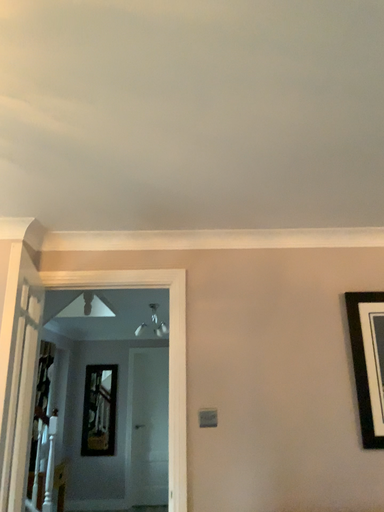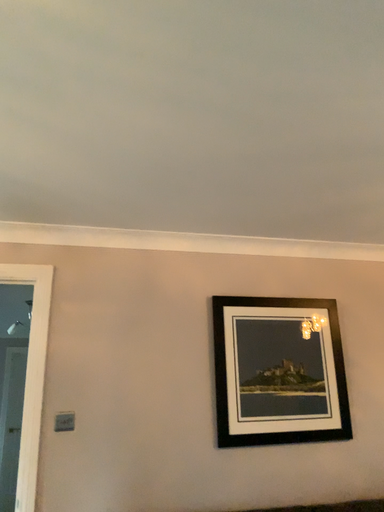
Question: Which way did the camera rotate in the video?

Choices:
 (A) rotated left
 (B) rotated right

Answer: (B)